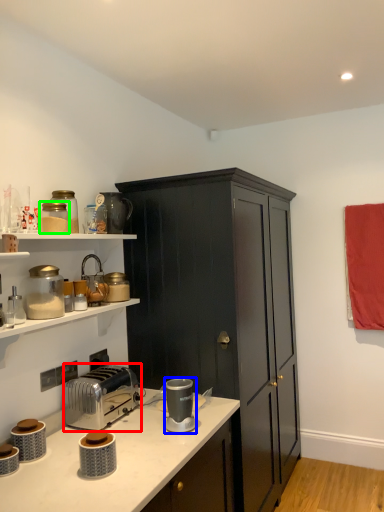
Question: Which is farther away from toaster (highlighted by a red box)? appliance (highlighted by a blue box) or appliance (highlighted by a green box)?

Choices:
 (A) appliance
 (B) appliance

Answer: (B)